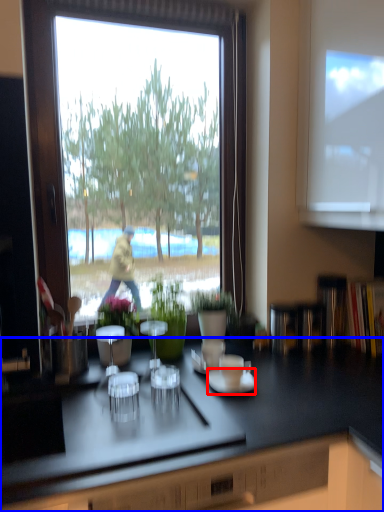
Question: Which object is closer to the camera taking this photo, saucer (highlighted by a red box) or countertop (highlighted by a blue box)?

Choices:
 (A) saucer
 (B) countertop

Answer: (B)